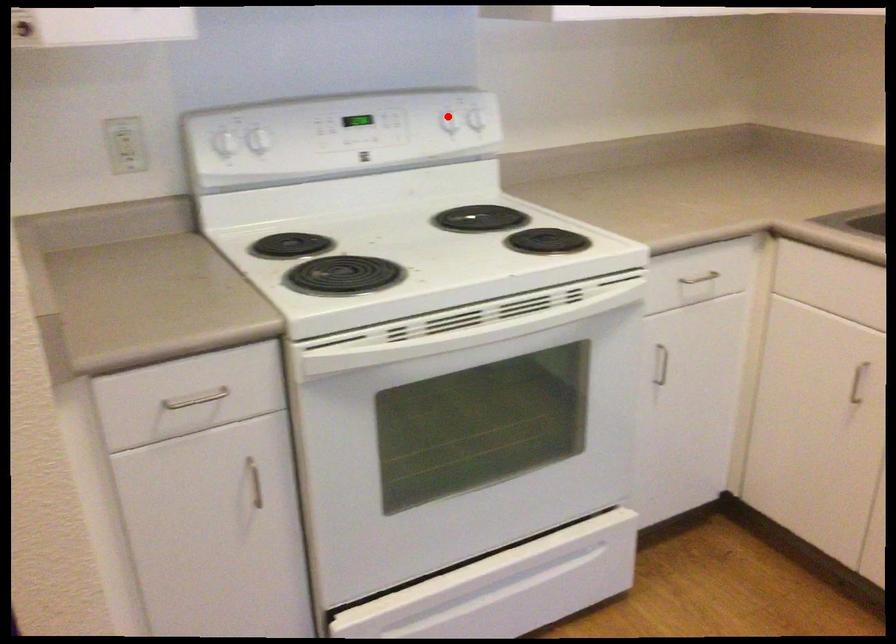
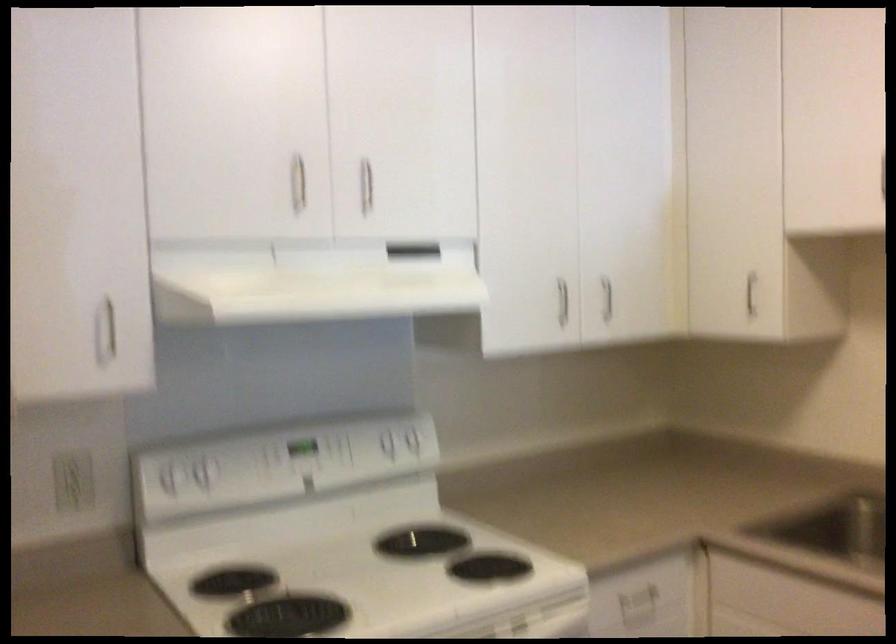
In the second image, find the point that corresponds to the highlighted location in the first image.

(385, 440)